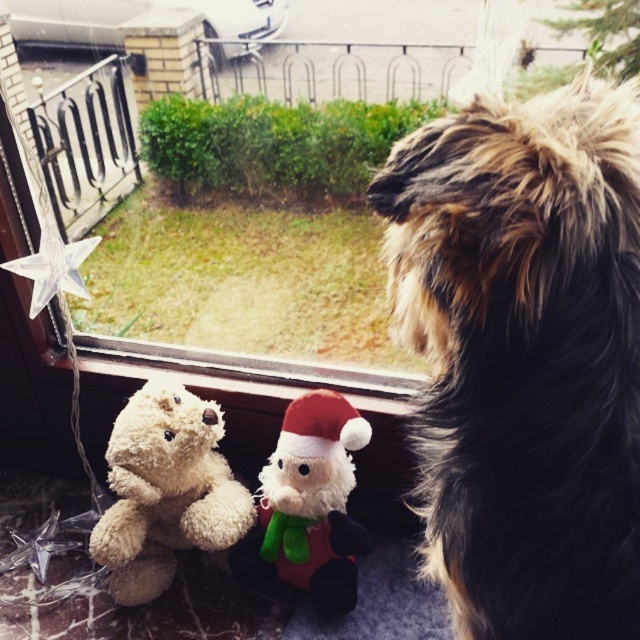
Can you confirm if soft beige teddy bear at lower left is positioned below white plush at center?

Yes, soft beige teddy bear at lower left is below white plush at center.

Does point (161, 528) come farther from viewer compared to point (122, 348)?

That is False.

Identify the location of soft beige teddy bear at lower left. The width and height of the screenshot is (640, 640). (164, 490).

Can you confirm if black fluffy dog at right is positioned above soft beige teddy bear at lower left?

Yes, black fluffy dog at right is above soft beige teddy bear at lower left.

Does black fluffy dog at right appear on the left side of soft beige teddy bear at lower left?

Incorrect, black fluffy dog at right is not on the left side of soft beige teddy bear at lower left.

Locate an element on the screen. The height and width of the screenshot is (640, 640). black fluffy dog at right is located at coordinates (524, 355).

Is point (516, 518) behind point (100, 364)?

No, it is not.

Which is below, black fluffy dog at right or white plush at center?

Positioned lower is white plush at center.

Is point (486, 291) behind point (257, 385)?

No, (486, 291) is closer to viewer.

In order to click on black fluffy dog at right in this screenshot , I will do `click(524, 355)`.